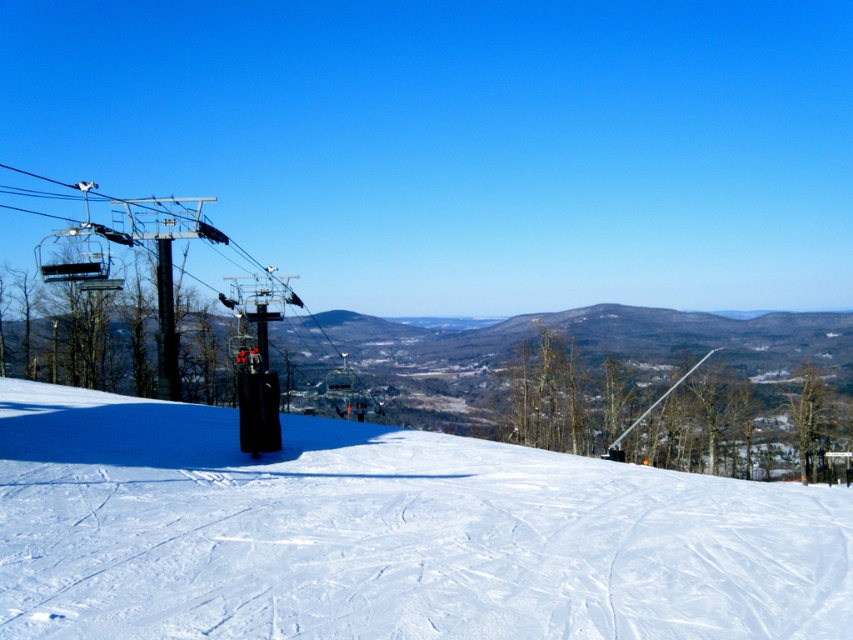
Question: Which point is closer to the camera taking this photo?

Choices:
 (A) (772, 493)
 (B) (248, 284)

Answer: (A)

Question: Is white powdery snow at center further to the viewer compared to metallic gray ski lift at left?

Choices:
 (A) no
 (B) yes

Answer: (A)

Question: Is white powdery snow at center positioned behind metallic gray ski lift at left?

Choices:
 (A) no
 (B) yes

Answer: (A)

Question: Which object is closer to the camera taking this photo?

Choices:
 (A) white powdery snow at center
 (B) metallic gray ski lift at left

Answer: (A)

Question: Does white powdery snow at center appear on the left side of metallic gray ski lift at left?

Choices:
 (A) no
 (B) yes

Answer: (A)